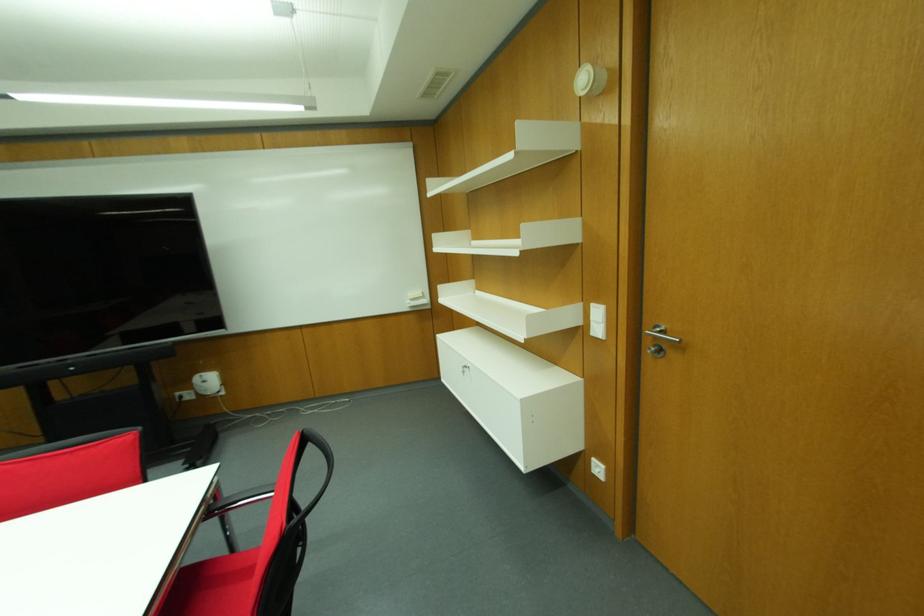
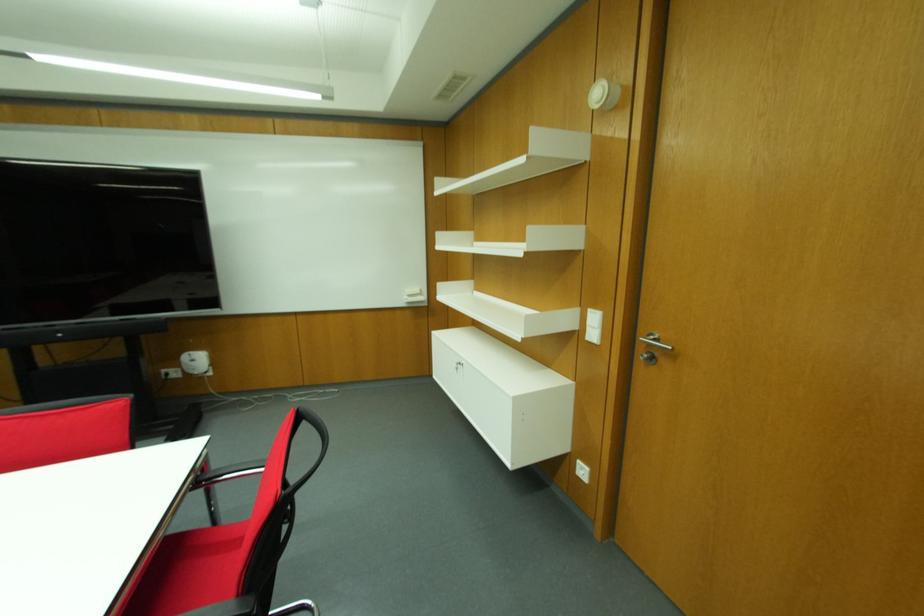
In the second image, find the point that corresponds to point (591, 305) in the first image.

(589, 310)